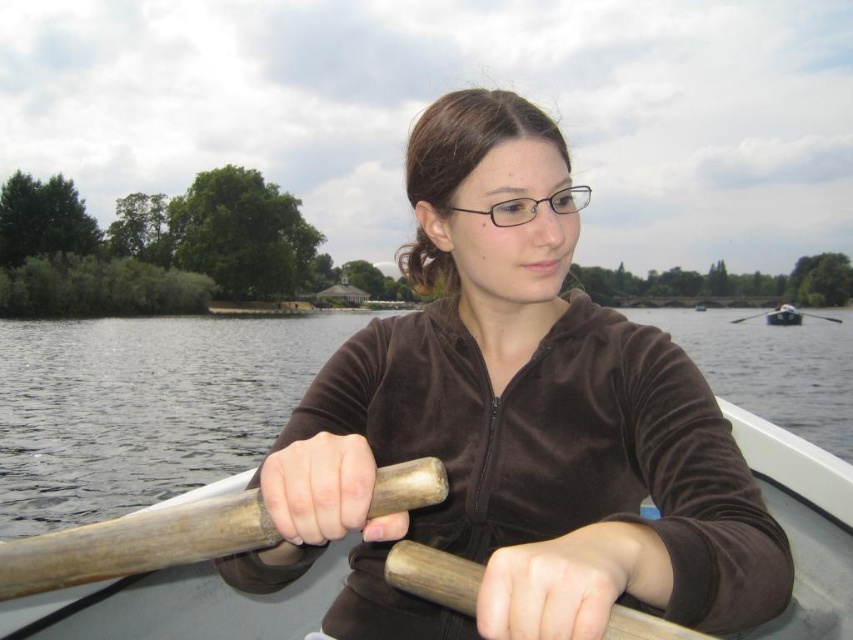
You are a fashion designer observing the person in the rowboat. You notice two jackets at the center of the image. Which one is shorter in height between the brown velvety jacket at center and the matte brown jacket at center?

The brown velvety jacket at center is shorter in height compared to the matte brown jacket at center.

You are a photographer planning to take a photo of the wooden at left and wooden at center in the scene. Which object should you place on the left side of your photo frame to ensure both are visible?

You should place the wooden at left on the left side of your photo frame since it is already positioned on the left side of the wooden at center, ensuring both objects are visible in the frame.